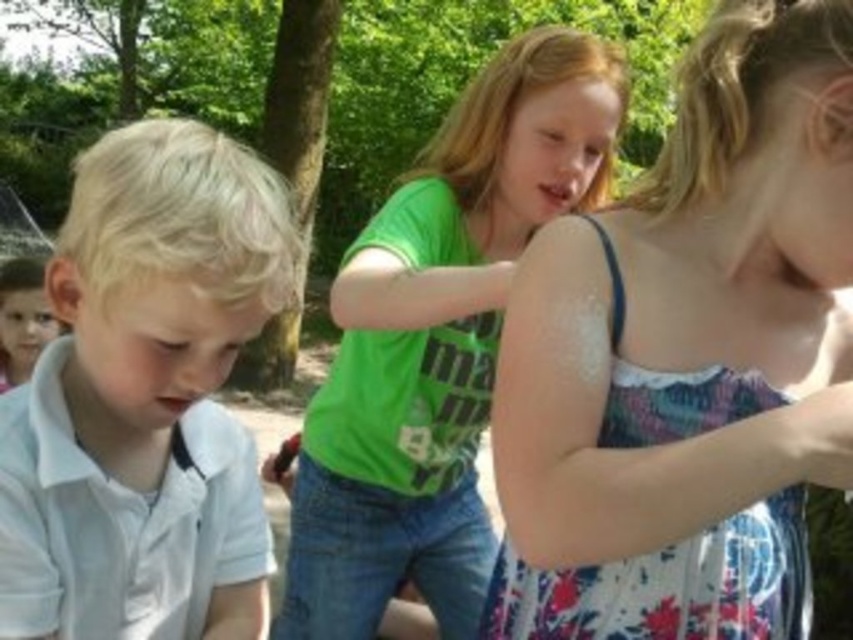
Question: Which point appears closest to the camera in this image?

Choices:
 (A) (844, 134)
 (B) (148, 484)

Answer: (A)

Question: Does floral dress at upper right appear over green matte shirt at center?

Choices:
 (A) no
 (B) yes

Answer: (B)

Question: Can you confirm if white matte shirt at left is thinner than green matte shirt at center?

Choices:
 (A) yes
 (B) no

Answer: (A)

Question: Estimate the real-world distances between objects in this image. Which object is farther from the white matte shirt at left?

Choices:
 (A) green matte shirt at center
 (B) floral dress at upper right

Answer: (A)

Question: Is white matte shirt at left above green matte shirt at center?

Choices:
 (A) yes
 (B) no

Answer: (A)

Question: Which object is the farthest from the white matte shirt at left?

Choices:
 (A) green matte shirt at center
 (B) floral dress at upper right

Answer: (A)